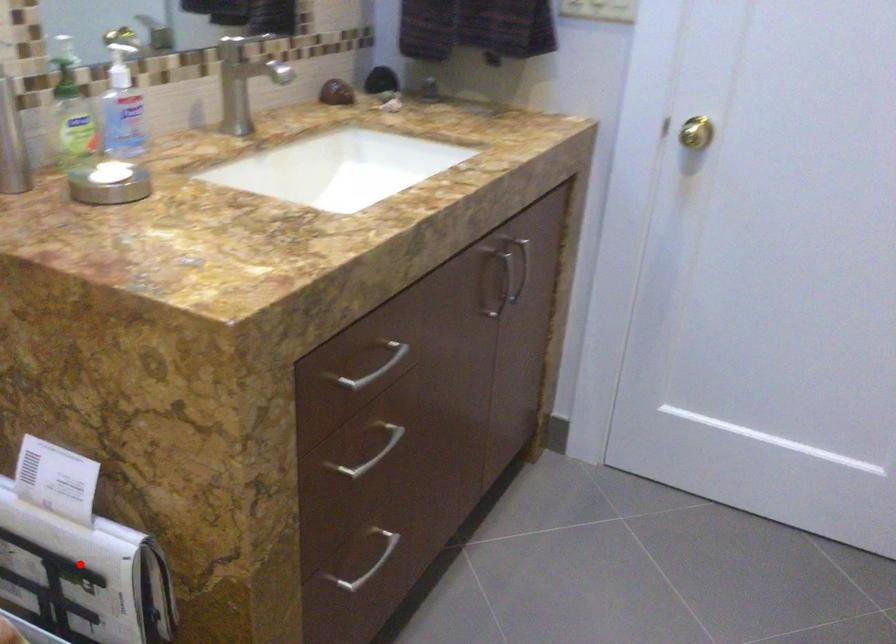
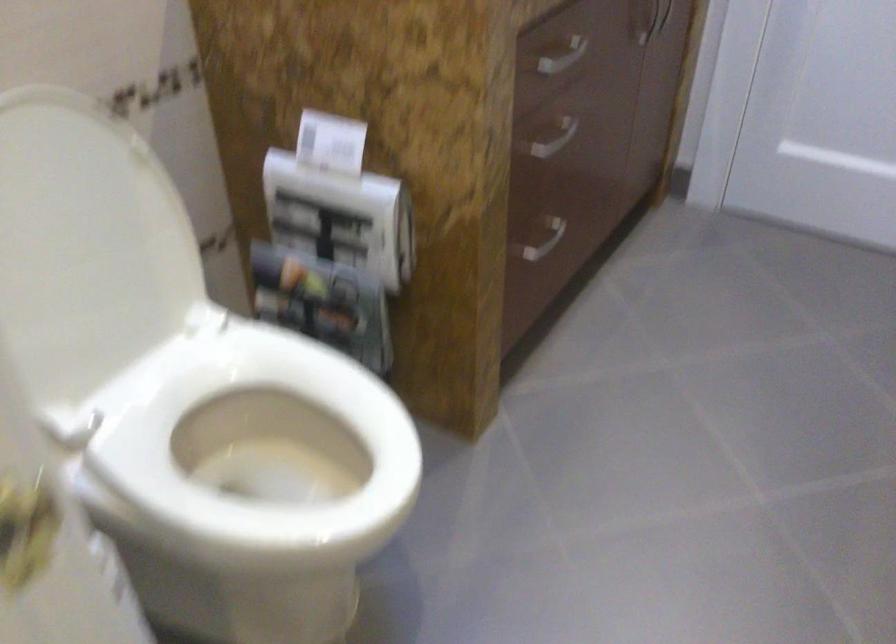
Find the pixel in the second image that matches the highlighted location in the first image.

(341, 216)